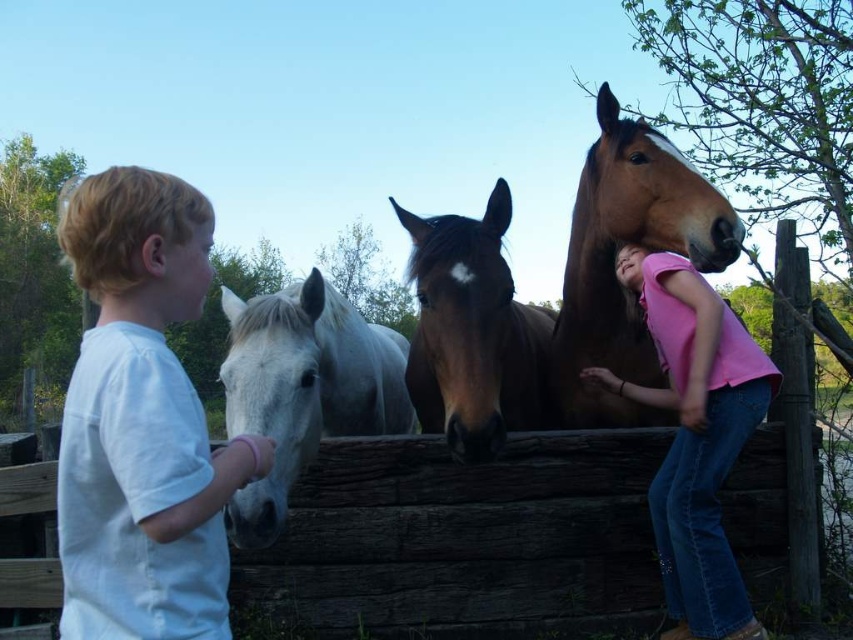
Is brown glossy horse at upper right smaller than white glossy horse at center?

Yes, brown glossy horse at upper right is smaller than white glossy horse at center.

Between brown glossy horse at upper right and white glossy horse at center, which one is positioned lower?

white glossy horse at center

Locate an element on the screen. This screenshot has width=853, height=640. brown glossy horse at upper right is located at coordinates (613, 259).

Does white cotton shirt at left have a greater width compared to brown glossy horse at center?

No.

Between point (86, 376) and point (497, 428), which one is positioned in front?

Positioned in front is point (86, 376).

Identify the location of white cotton shirt at left. (142, 420).

Is pink cotton shirt at upper right positioned before white glossy horse at center?

No, pink cotton shirt at upper right is behind white glossy horse at center.

From the picture: Between pink cotton shirt at upper right and white glossy horse at center, which one is positioned lower?

pink cotton shirt at upper right

Who is more forward, (654, 330) or (332, 381)?

Point (654, 330) is more forward.

Identify the location of pink cotton shirt at upper right. (695, 436).